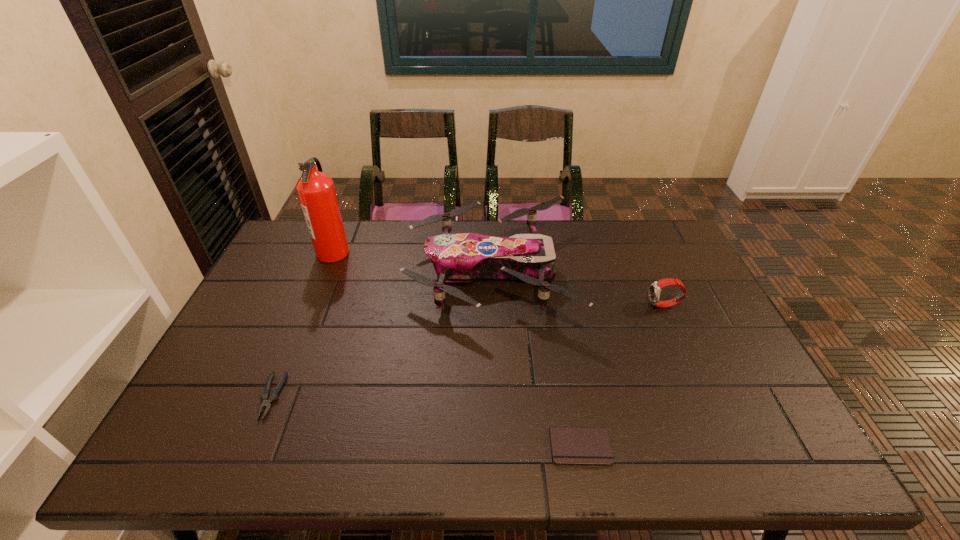
Image resolution: width=960 pixels, height=540 pixels. In order to click on vacant area between the drone and the fourth farthest object in this screenshot , I will do `click(380, 334)`.

This screenshot has height=540, width=960. I want to click on vacant area that lies between the checkbook and the fourth tallest object, so click(426, 422).

The height and width of the screenshot is (540, 960). I want to click on free space that is in between the fourth farthest object and the shortest object, so click(x=426, y=422).

Find the location of a particular element. The image size is (960, 540). vacant region between the checkbook and the fourth shortest object is located at coordinates (535, 360).

This screenshot has width=960, height=540. I want to click on unoccupied position between the second shortest object and the watch, so (x=468, y=351).

Where is `free area in between the pliers and the rightmost object`? free area in between the pliers and the rightmost object is located at coordinates (468, 351).

Find the location of a particular element. free space that is in between the rightmost object and the drone is located at coordinates (577, 289).

Locate an element on the screen. This screenshot has width=960, height=540. object identified as the fourth closest to the second tallest object is located at coordinates (267, 400).

Where is `object that is the fourth closest one to the second nearest object`? Image resolution: width=960 pixels, height=540 pixels. object that is the fourth closest one to the second nearest object is located at coordinates (655, 288).

At what (x,y) coordinates should I click in order to perform the action: click on vacant space that satisfies the following two spatial constraints: 1. at the nozzle of the fire extinguisher; 2. on the back side of the nearest object. Please return your answer as a coordinate pair (x, y). Looking at the image, I should click on (254, 447).